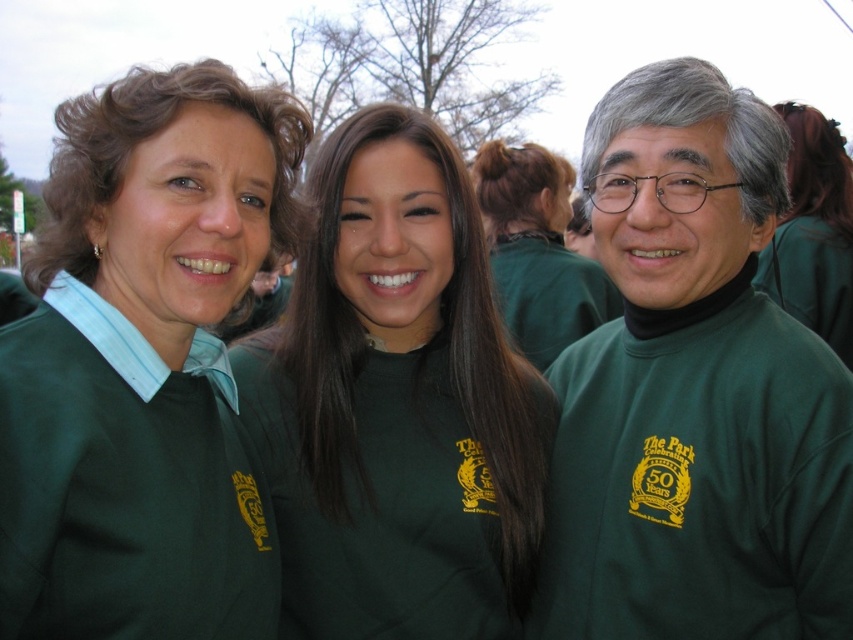
Which of these two, green matte sweatshirt at center or green matte shirt at center, stands shorter?

Standing shorter between the two is green matte shirt at center.

Is point (329, 188) closer to camera compared to point (531, 157)?

Yes.

At what (x,y) coordinates should I click in order to perform the action: click on green matte sweatshirt at center. Please return your answer as a coordinate pair (x, y). The width and height of the screenshot is (853, 640). Looking at the image, I should click on (396, 412).

Does green matte shirt at center have a greater width compared to green matte shirt at upper right?

Yes, green matte shirt at center is wider than green matte shirt at upper right.

Between point (544, 212) and point (804, 157), which one is positioned in front?

Positioned in front is point (804, 157).

Identify the location of green matte shirt at center. (537, 252).

Does point (660, 390) lie in front of point (503, 552)?

Yes, point (660, 390) is in front of point (503, 552).

Between green turtleneck sweater at right and green matte sweatshirt at center, which one appears on the right side from the viewer's perspective?

Positioned to the right is green turtleneck sweater at right.

The image size is (853, 640). Describe the element at coordinates (694, 392) in the screenshot. I see `green turtleneck sweater at right` at that location.

Locate an element on the screen. green turtleneck sweater at right is located at coordinates (694, 392).